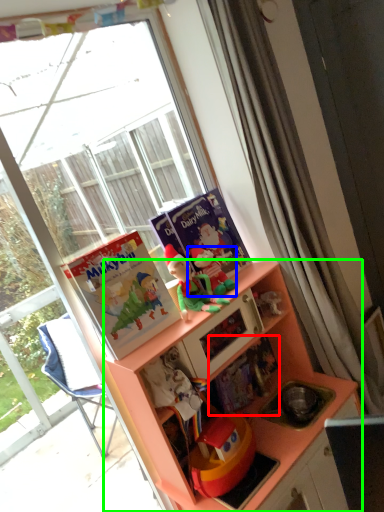
Question: Considering the real-world distances, which object is farthest from book (highlighted by a red box)? toy (highlighted by a blue box) or cabinetry (highlighted by a green box)?

Choices:
 (A) toy
 (B) cabinetry

Answer: (A)